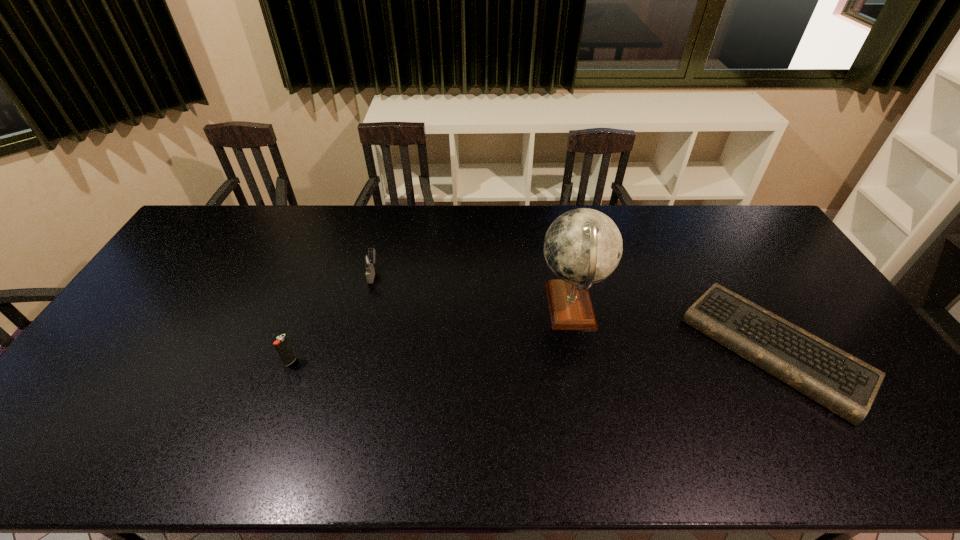
Find the location of a particular element. This screenshot has width=960, height=540. the second object from right to left is located at coordinates (583, 246).

Identify the location of the tallest object. The height and width of the screenshot is (540, 960). (583, 246).

Where is `the farther igniter`? This screenshot has height=540, width=960. the farther igniter is located at coordinates (368, 260).

Identify the location of the right igniter. (368, 260).

Where is `the left igniter`? the left igniter is located at coordinates (282, 345).

You are a GUI agent. You are given a task and a screenshot of the screen. Output one action in this format:
    pyautogui.click(x=<x>, y=<y>)
    Task: Click on the nearer igniter
    
    Given the screenshot: What is the action you would take?
    pyautogui.click(x=282, y=345)

I want to click on computer keyboard, so click(847, 386).

I want to click on the rightmost object, so click(847, 386).

The image size is (960, 540). What are the coordinates of `free space located at the equator of the third object from left to right` in the screenshot? It's located at (511, 307).

The height and width of the screenshot is (540, 960). I want to click on free space located at the equator of the third object from left to right, so click(x=514, y=307).